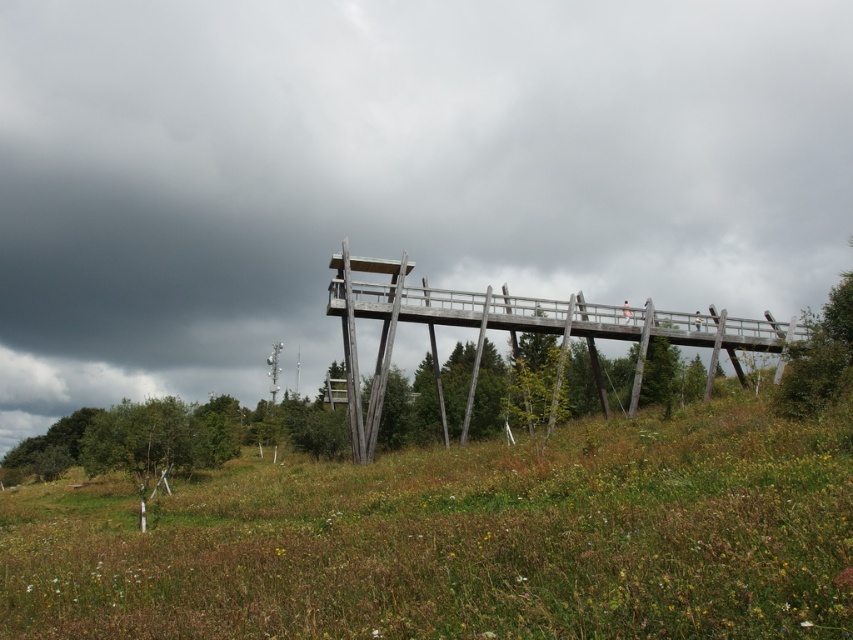
Question: Which point is farther to the camera?

Choices:
 (A) (334, 308)
 (B) (93, 602)
 (C) (759, 225)

Answer: (C)

Question: Is gray cloudy sky at upper center positioned at the back of pink fabric person at center?

Choices:
 (A) yes
 (B) no

Answer: (B)

Question: Does green grassy at center have a greater width compared to pink fabric person at center?

Choices:
 (A) yes
 (B) no

Answer: (A)

Question: Can you confirm if gray cloudy sky at upper center is positioned below green grassy at center?

Choices:
 (A) yes
 (B) no

Answer: (B)

Question: Considering the real-world distances, which object is closest to the pink fabric person at center?

Choices:
 (A) gray cloudy sky at upper center
 (B) green grassy at center
 (C) wooden bridge at center

Answer: (C)

Question: Which of the following is the farthest from the observer?

Choices:
 (A) pink fabric person at center
 (B) gray cloudy sky at upper center

Answer: (A)